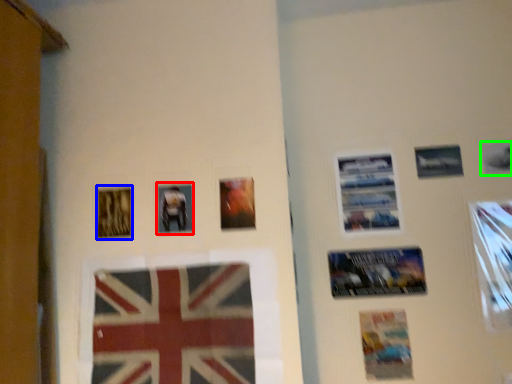
Question: Considering the real-world distances, which object is closest to picture frame (highlighted by a red box)? picture frame (highlighted by a blue box) or picture frame (highlighted by a green box).

Choices:
 (A) picture frame
 (B) picture frame

Answer: (A)